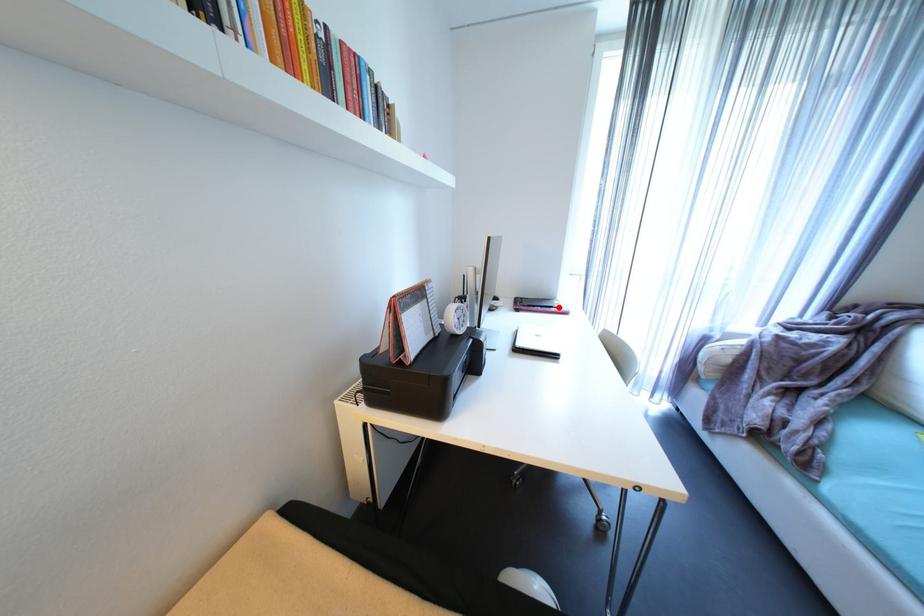
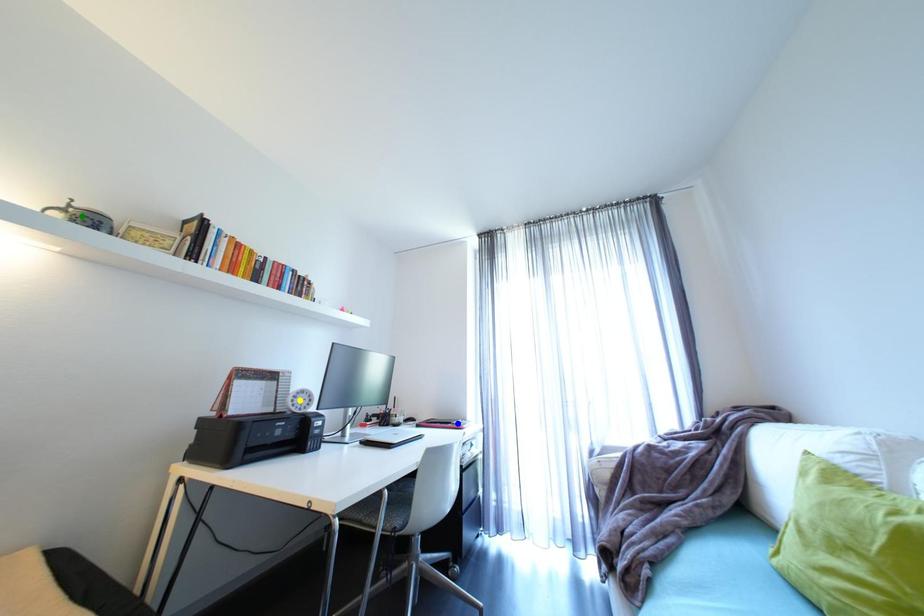
Question: I am providing you with two images of the same scene from different viewpoints. A red point is marked on the first image. You are given multiple points on the second image. Can you choose the point in image 2 that corresponds to the point in image 1?

Choices:
 (A) green point
 (B) blue point
 (C) yellow point

Answer: (B)